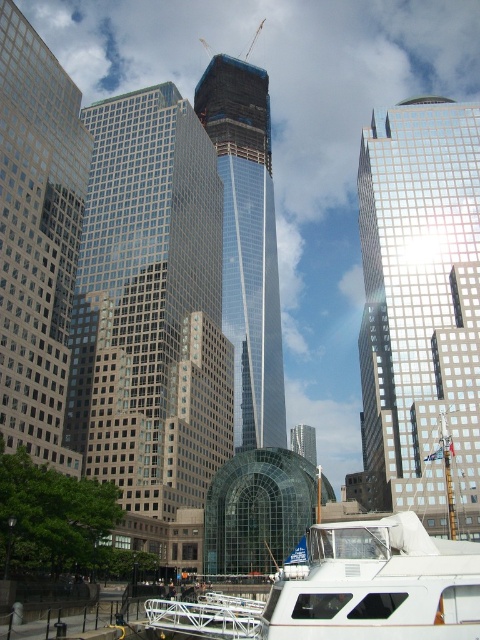
Question: Observing the image, what is the correct spatial positioning of glassy reflective skyscraper at left in reference to transparent glass skyscraper at center?

Choices:
 (A) left
 (B) right

Answer: (A)

Question: Can you confirm if white matte boat at lower right is bigger than transparent glass skyscraper at center?

Choices:
 (A) no
 (B) yes

Answer: (A)

Question: Is reflective glass skyscraper at center above white matte boat at lower right?

Choices:
 (A) no
 (B) yes

Answer: (B)

Question: Among these points, which one is farthest from the camera?

Choices:
 (A) [467, 404]
 (B) [36, 211]
 (C) [225, 618]
 (D) [260, 125]

Answer: (D)

Question: Which point is farther to the camera?

Choices:
 (A) glassy reflective skyscraper at left
 (B) reflective glass skyscraper at center
 (C) glassy skyscraper at center

Answer: (C)

Question: Based on their relative distances, which object is nearer to the white matte boat at lower right?

Choices:
 (A) glassy reflective skyscraper at left
 (B) reflective glass skyscraper at center
 (C) transparent glass skyscraper at center

Answer: (A)